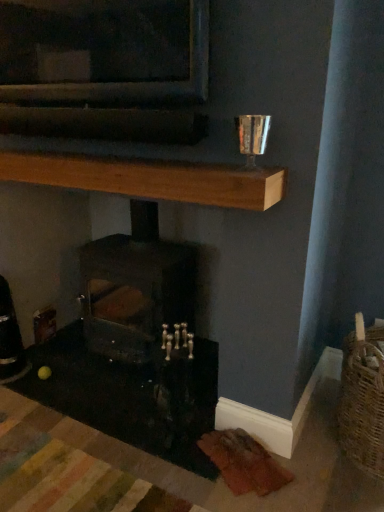
This screenshot has height=512, width=384. Find the location of `unoccupied area in front of dark gray stone wood burning stove at center`. unoccupied area in front of dark gray stone wood burning stove at center is located at coordinates (100, 418).